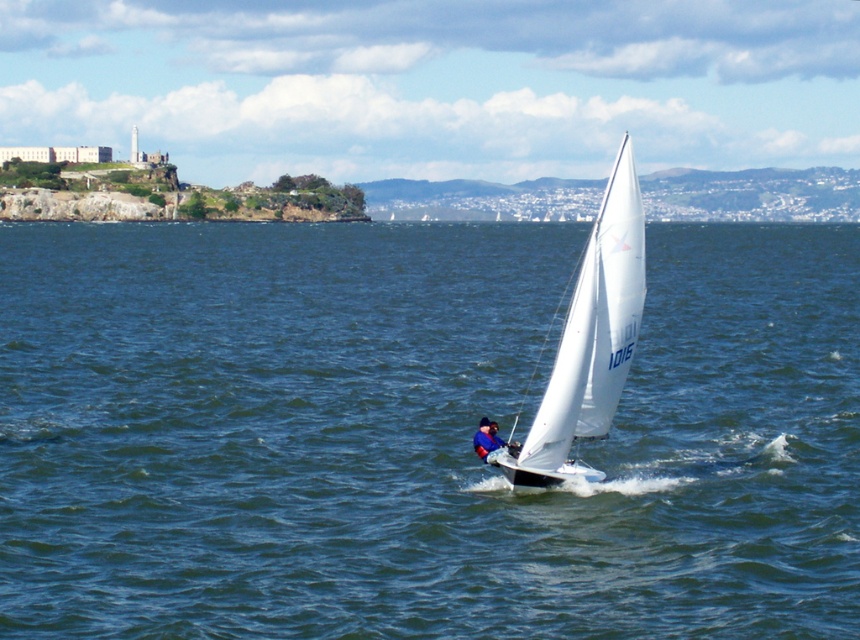
Question: Which is nearer to the blue water at center?

Choices:
 (A) white sailboat at center
 (B) blue fabric sailboat at center

Answer: (B)

Question: Where is white sailboat at center located in relation to blue fabric sailboat at center in the image?

Choices:
 (A) above
 (B) below

Answer: (A)

Question: Is blue water at center wider than blue fabric sailboat at center?

Choices:
 (A) yes
 (B) no

Answer: (A)

Question: Which of these objects is positioned farthest from the blue water at center?

Choices:
 (A) white sailboat at center
 (B) blue fabric sailboat at center

Answer: (A)

Question: Is white sailboat at center thinner than blue fabric sailboat at center?

Choices:
 (A) yes
 (B) no

Answer: (B)

Question: Which object appears farthest from the camera in this image?

Choices:
 (A) blue fabric sailboat at center
 (B) blue water at center

Answer: (A)